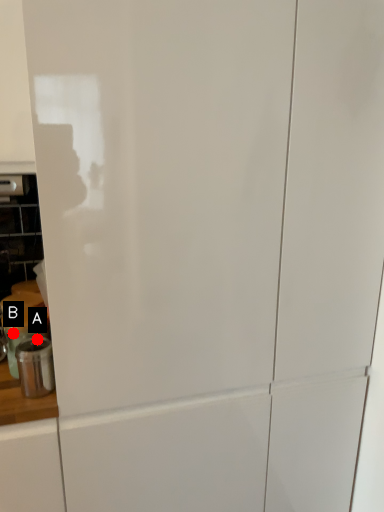
Question: Two points are circled on the image, labeled by A and B beside each circle. Which of the following is the closest to the observer?

Choices:
 (A) A is closer
 (B) B is closer

Answer: (A)